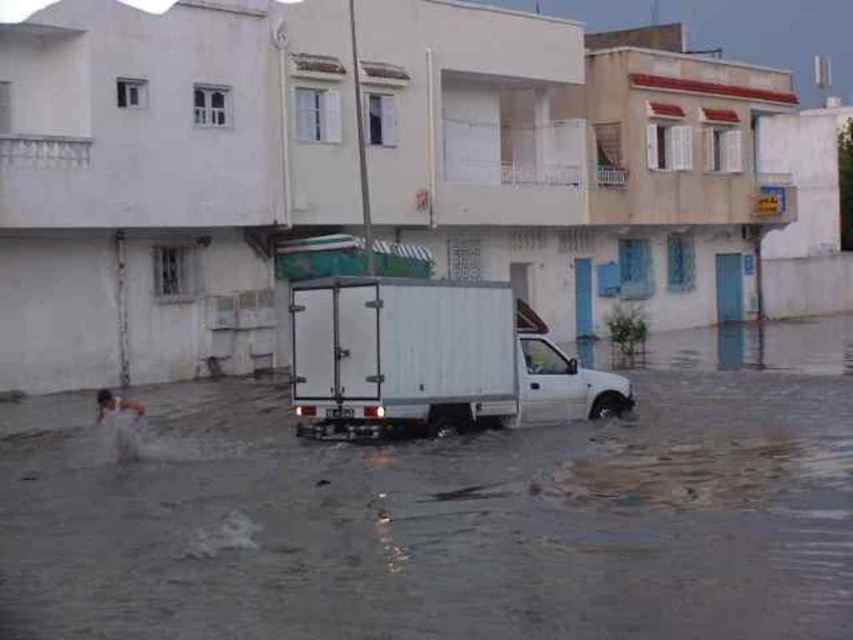
You are standing on the flooded street and see the white matte truck at center. If the water depth here is 1.5 meters, and the truck has a ground clearance of 220 millimeters, will the truck be submerged under water?

The white matte truck at center is 16.19 meters away from the viewer. The truck has a ground clearance of 220 millimeters, which is 0.22 meters. Since the water depth is 1.5 meters, which is deeper than the ground clearance, the truck will be submerged under water.

You are a rescue drone operator trying to locate safe areas in the flooded street. The white pickup truck is in the middle of the street. Where exactly is the clear water at truck center located in terms of coordinates?

The clear water at truck center is located at coordinates point [450,513].

You are a rescue worker trying to reach a stranded person on the flooded street. You see the clear water at truck center and the white matte truck at center. Which object takes up more space in the image?

The clear water at truck center is bigger than the white matte truck at center, so it occupies more space in the image.